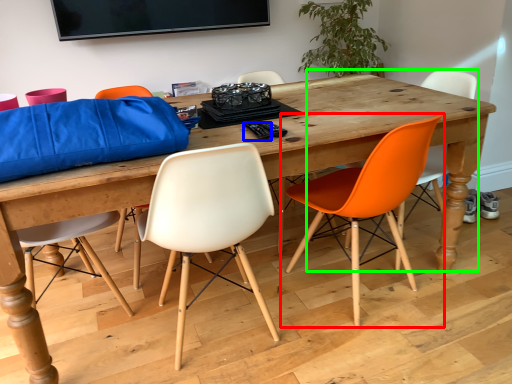
Question: Estimate the real-world distances between objects in this image. Which object is farther from chair (highlighted by a red box), remote control (highlighted by a blue box) or chair (highlighted by a green box)?

Choices:
 (A) remote control
 (B) chair

Answer: (B)